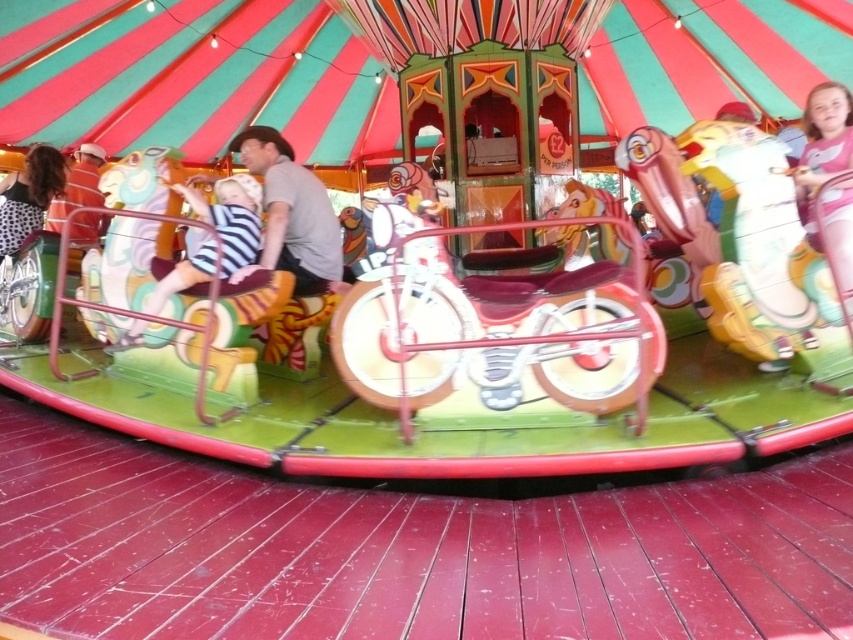
Question: Can you confirm if pink fabric dress at upper right is positioned to the right of spotted fabric shirt at upper left?

Choices:
 (A) no
 (B) yes

Answer: (B)

Question: Which point is farther from the camera taking this photo?

Choices:
 (A) (45, 150)
 (B) (837, 113)
 (C) (160, 285)

Answer: (A)

Question: Which object appears closest to the camera in this image?

Choices:
 (A) pink fabric dress at upper right
 (B) matte gray shirt at center
 (C) spotted fabric shirt at upper left

Answer: (A)

Question: Does matte gray shirt at center appear under spotted fabric shirt at upper left?

Choices:
 (A) yes
 (B) no

Answer: (A)

Question: Is pink fabric dress at upper right positioned at the back of spotted fabric shirt at upper left?

Choices:
 (A) no
 (B) yes

Answer: (A)

Question: Among these points, which one is farthest from the camera?

Choices:
 (A) (x=312, y=193)
 (B) (x=842, y=282)
 (C) (x=194, y=262)
 (D) (x=45, y=145)

Answer: (D)